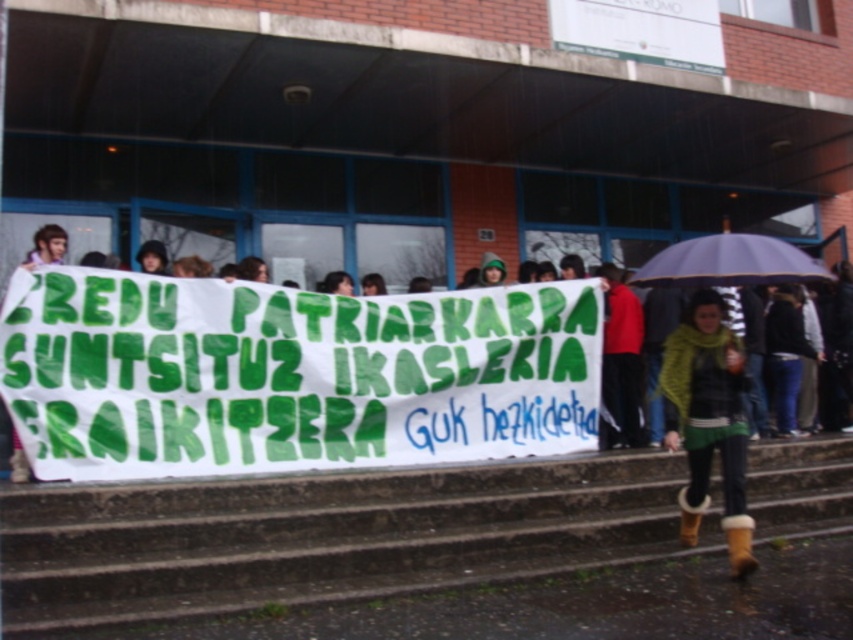
You are a delivery person holding a package and need to place it on the concrete stairs at center. However, you notice the red matte jacket at center is already on the stairs. Can you still place your package on the stairs without moving the jacket?

The concrete stairs at center is not as tall as red matte jacket at center, so the jacket is taller than the stairs. This means the jacket is likely placed on top of the stairs, making space for the package to be placed alongside it.

You are standing at the entrance of the building and want to walk to the red matte jacket at center. Is the matte purple umbrella at right blocking your path?

The matte purple umbrella at right is closer to the viewer than the red matte jacket at center, so it is blocking the path to the red matte jacket at center.

You are standing at the entrance of the building and want to walk towards the point marked as point (161,250). However, there is an obstacle at point (131,540). Can you reach your destination without going around the obstacle?

Since point (131,540) is in front of point (161,250), you cannot reach point (161,250) without going around the obstacle at point (131,540).